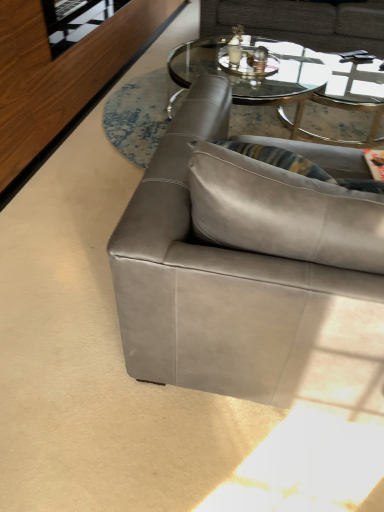
The height and width of the screenshot is (512, 384). Describe the element at coordinates (75, 20) in the screenshot. I see `transparent glass door at upper left` at that location.

Measure the distance between point (325,148) and camera.

A distance of 1.81 meters exists between point (325,148) and camera.

Find the location of a particular element. The height and width of the screenshot is (512, 384). suede gray couch at center, acting as the second studio couch starting from the top is located at coordinates (248, 273).

Describe the element at coordinates (295, 87) in the screenshot. I see `transparent glass coffee table at center` at that location.

At what (x,y) coordinates should I click in order to perform the action: click on gray leather couch at upper center, which appears as the second studio couch when ordered from the bottom. Please return your answer as a coordinate pair (x, y). The height and width of the screenshot is (512, 384). Looking at the image, I should click on coord(301,22).

From the picture: From a real-world perspective, is gray leather couch at upper center, placed as the 1th studio couch when sorted from top to bottom, physically located above or below transparent glass coffee table at center?

In terms of real-world spatial position, gray leather couch at upper center, placed as the 1th studio couch when sorted from top to bottom, is above transparent glass coffee table at center.

Considering the relative positions of gray leather couch at upper center, acting as the second studio couch starting from the front, and transparent glass coffee table at center in the image provided, is gray leather couch at upper center, acting as the second studio couch starting from the front, to the left of transparent glass coffee table at center from the viewer's perspective?

In fact, gray leather couch at upper center, acting as the second studio couch starting from the front, is to the right of transparent glass coffee table at center.

Are gray leather couch at upper center, the first studio couch positioned from the back, and transparent glass coffee table at center far apart?

No, gray leather couch at upper center, the first studio couch positioned from the back, is not far from transparent glass coffee table at center.

Identify the location of glass door located on the left of suede gray couch at center, positioned as the 1th studio couch in front-to-back order. (75, 20).

Which object is wider, suede gray couch at center, the 2th studio couch when ordered from back to front, or transparent glass door at upper left?

With larger width is suede gray couch at center, the 2th studio couch when ordered from back to front.

Which is behind, point (160, 304) or point (111, 4)?

The point (111, 4) is behind.

Is suede gray couch at center, arranged as the first studio couch when ordered from the bottom, situated inside transparent glass door at upper left or outside?

suede gray couch at center, arranged as the first studio couch when ordered from the bottom, exists outside the volume of transparent glass door at upper left.

Between suede gray couch at center, acting as the second studio couch starting from the top, and gray leather couch at upper center, placed as the 1th studio couch when sorted from top to bottom, which one appears on the left side from the viewer's perspective?

From the viewer's perspective, suede gray couch at center, acting as the second studio couch starting from the top, appears more on the left side.

Is suede gray couch at center, positioned as the 1th studio couch in front-to-back order, facing towards gray leather couch at upper center, acting as the second studio couch starting from the front?

Yes, suede gray couch at center, positioned as the 1th studio couch in front-to-back order, is aimed at gray leather couch at upper center, acting as the second studio couch starting from the front.

Is suede gray couch at center, arranged as the first studio couch when ordered from the bottom, not within gray leather couch at upper center, which appears as the second studio couch when ordered from the bottom?

Yes, suede gray couch at center, arranged as the first studio couch when ordered from the bottom, is located beyond the bounds of gray leather couch at upper center, which appears as the second studio couch when ordered from the bottom.

Can you see suede gray couch at center, arranged as the first studio couch when ordered from the bottom, touching gray leather couch at upper center, acting as the second studio couch starting from the front?

No, suede gray couch at center, arranged as the first studio couch when ordered from the bottom, is not in contact with gray leather couch at upper center, acting as the second studio couch starting from the front.

Is transparent glass coffee table at center looking in the opposite direction of transparent glass door at upper left?

No, transparent glass coffee table at center is not facing away from transparent glass door at upper left.

From a real-world perspective, who is located lower, transparent glass coffee table at center or transparent glass door at upper left?

From a 3D spatial view, transparent glass coffee table at center is below.

Which is behind, transparent glass coffee table at center or transparent glass door at upper left?

transparent glass coffee table at center is behind.

Is transparent glass coffee table at center at the right side of transparent glass door at upper left?

Indeed, transparent glass coffee table at center is positioned on the right side of transparent glass door at upper left.

Considering the points (78, 16) and (311, 314), which point is in front, point (78, 16) or point (311, 314)?

Positioned in front is point (311, 314).

From the image's perspective, between transparent glass door at upper left and suede gray couch at center, positioned as the 1th studio couch in front-to-back order, who is located below?

suede gray couch at center, positioned as the 1th studio couch in front-to-back order.

Locate an element on the screen. glass door above the suede gray couch at center, the 2th studio couch when ordered from back to front (from a real-world perspective) is located at coordinates (75, 20).

From a real-world perspective, is transparent glass door at upper left below suede gray couch at center, positioned as the 1th studio couch in front-to-back order?

No, from a real-world perspective, transparent glass door at upper left is not under suede gray couch at center, positioned as the 1th studio couch in front-to-back order.

Is transparent glass door at upper left bigger than gray leather couch at upper center, acting as the second studio couch starting from the front?

No, transparent glass door at upper left is not bigger than gray leather couch at upper center, acting as the second studio couch starting from the front.

Does transparent glass door at upper left touch gray leather couch at upper center, acting as the second studio couch starting from the front?

transparent glass door at upper left and gray leather couch at upper center, acting as the second studio couch starting from the front, are not in contact.

Is the depth of transparent glass door at upper left less than that of gray leather couch at upper center, placed as the 1th studio couch when sorted from top to bottom?

Yes, it is.

Is transparent glass door at upper left aimed at gray leather couch at upper center, which appears as the second studio couch when ordered from the bottom?

No, transparent glass door at upper left does not turn towards gray leather couch at upper center, which appears as the second studio couch when ordered from the bottom.

Can you confirm if transparent glass coffee table at center is taller than gray leather couch at upper center, the first studio couch positioned from the back?

No, transparent glass coffee table at center is not taller than gray leather couch at upper center, the first studio couch positioned from the back.

The image size is (384, 512). Identify the location of studio couch above the transparent glass coffee table at center (from the image's perspective). (301, 22).

Is transparent glass coffee table at center wider or thinner than gray leather couch at upper center, placed as the 1th studio couch when sorted from top to bottom?

transparent glass coffee table at center is wider than gray leather couch at upper center, placed as the 1th studio couch when sorted from top to bottom.

Do you think transparent glass coffee table at center is within gray leather couch at upper center, acting as the second studio couch starting from the front, or outside of it?

The correct answer is: outside.

Identify the location of coffee table that appears below the gray leather couch at upper center, placed as the 1th studio couch when sorted from top to bottom (from a real-world perspective). Image resolution: width=384 pixels, height=512 pixels. (295, 87).

Locate an element on the screen. The image size is (384, 512). studio couch below the transparent glass door at upper left (from the image's perspective) is located at coordinates (248, 273).

Looking at the image, which one is located further to transparent glass coffee table at center, suede gray couch at center, acting as the second studio couch starting from the top, or transparent glass door at upper left?

suede gray couch at center, acting as the second studio couch starting from the top.

Based on their spatial positions, is transparent glass coffee table at center or gray leather couch at upper center, the first studio couch positioned from the back, closer to transparent glass door at upper left?

transparent glass coffee table at center lies closer to transparent glass door at upper left than the other object.

Based on their spatial positions, is transparent glass door at upper left or transparent glass coffee table at center closer to suede gray couch at center, positioned as the 1th studio couch in front-to-back order?

transparent glass door at upper left is closer to suede gray couch at center, positioned as the 1th studio couch in front-to-back order.

Which object lies nearer to the anchor point gray leather couch at upper center, placed as the 1th studio couch when sorted from top to bottom, suede gray couch at center, acting as the second studio couch starting from the top, or transparent glass coffee table at center?

Among the two, transparent glass coffee table at center is located nearer to gray leather couch at upper center, placed as the 1th studio couch when sorted from top to bottom.

When comparing their distances from transparent glass coffee table at center, does gray leather couch at upper center, which appears as the second studio couch when ordered from the bottom, or transparent glass door at upper left seem closer?

gray leather couch at upper center, which appears as the second studio couch when ordered from the bottom, lies closer to transparent glass coffee table at center than the other object.

When comparing their distances from transparent glass coffee table at center, does suede gray couch at center, acting as the second studio couch starting from the top, or gray leather couch at upper center, the first studio couch positioned from the back, seem further?

suede gray couch at center, acting as the second studio couch starting from the top.

Considering their positions, is suede gray couch at center, acting as the second studio couch starting from the top, positioned further to transparent glass door at upper left than gray leather couch at upper center, the first studio couch positioned from the back?

gray leather couch at upper center, the first studio couch positioned from the back, is positioned further to the anchor transparent glass door at upper left.

When comparing their distances from transparent glass door at upper left, does gray leather couch at upper center, acting as the second studio couch starting from the front, or transparent glass coffee table at center seem closer?

Based on the image, transparent glass coffee table at center appears to be nearer to transparent glass door at upper left.

Where is `coffee table located between transparent glass door at upper left and gray leather couch at upper center, which appears as the second studio couch when ordered from the bottom, in the left-right direction`? The image size is (384, 512). coffee table located between transparent glass door at upper left and gray leather couch at upper center, which appears as the second studio couch when ordered from the bottom, in the left-right direction is located at coordinates (295, 87).

Locate an element on the screen. coffee table between suede gray couch at center, arranged as the first studio couch when ordered from the bottom, and gray leather couch at upper center, the first studio couch positioned from the back, in the front-back direction is located at coordinates (295, 87).

What are the coordinates of `glass door positioned between suede gray couch at center, positioned as the 1th studio couch in front-to-back order, and gray leather couch at upper center, placed as the 1th studio couch when sorted from top to bottom, from near to far` in the screenshot? It's located at (75, 20).

At what (x,y) coordinates should I click in order to perform the action: click on glass door between suede gray couch at center, arranged as the first studio couch when ordered from the bottom, and transparent glass coffee table at center, along the z-axis. Please return your answer as a coordinate pair (x, y). Looking at the image, I should click on (75, 20).